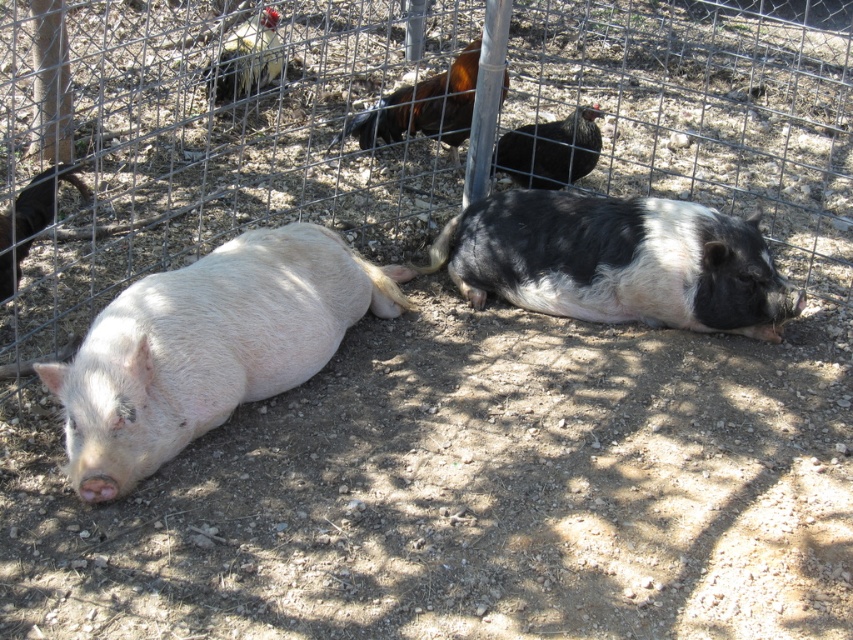
Question: Which point is closer to the camera?

Choices:
 (A) coord(766,250)
 (B) coord(196,337)

Answer: (B)

Question: Observing the image, what is the correct spatial positioning of matte pink pig at left in reference to black and white fur at center?

Choices:
 (A) left
 (B) right

Answer: (A)

Question: Which of the following is the farthest from the observer?

Choices:
 (A) matte pink pig at left
 (B) black and white fur at center

Answer: (B)

Question: Is matte pink pig at left wider than black and white fur at center?

Choices:
 (A) yes
 (B) no

Answer: (B)

Question: Considering the relative positions of matte pink pig at left and black and white fur at center in the image provided, where is matte pink pig at left located with respect to black and white fur at center?

Choices:
 (A) left
 (B) right

Answer: (A)